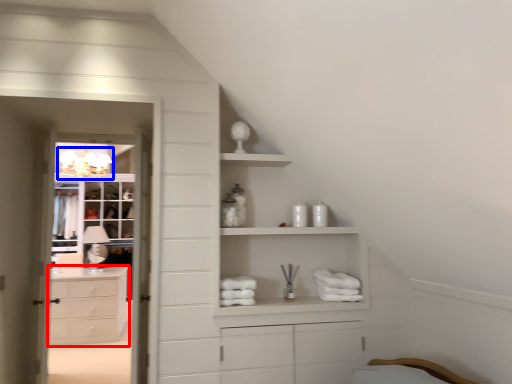
Question: Among these objects, which one is nearest to the camera, chest of drawers (highlighted by a red box) or light fixture (highlighted by a blue box)?

Choices:
 (A) chest of drawers
 (B) light fixture

Answer: (A)